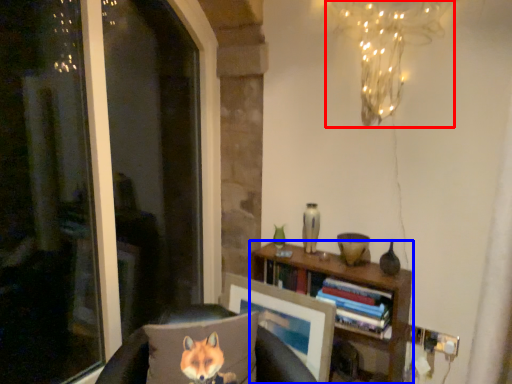
Question: Which object appears closest to the camera in this image, lamp (highlighted by a red box) or bookcase (highlighted by a blue box)?

Choices:
 (A) lamp
 (B) bookcase

Answer: (A)